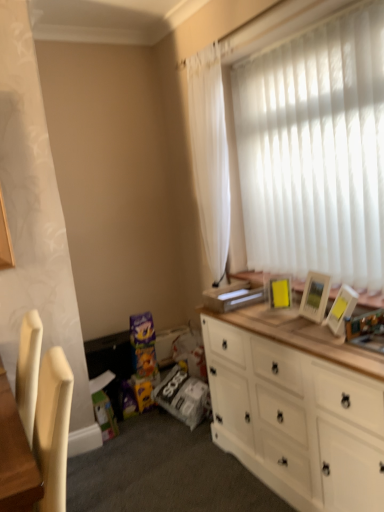
Question: Is white wood cabinet at right to the right of white glossy picture frame at upper right, acting as the second picture frame starting from the left, from the viewer's perspective?

Choices:
 (A) no
 (B) yes

Answer: (A)

Question: Considering the relative sizes of white wood cabinet at right and white glossy picture frame at upper right, which is the second picture frame in back-to-front order, in the image provided, is white wood cabinet at right shorter than white glossy picture frame at upper right, which is the second picture frame in back-to-front order,?

Choices:
 (A) yes
 (B) no

Answer: (B)

Question: From the image's perspective, is white wood cabinet at right below white glossy picture frame at upper right, the first picture frame in the right-to-left sequence?

Choices:
 (A) yes
 (B) no

Answer: (A)

Question: Is the depth of white wood cabinet at right less than that of white glossy picture frame at upper right, acting as the second picture frame starting from the left?

Choices:
 (A) no
 (B) yes

Answer: (B)

Question: Would you say white wood cabinet at right is outside white glossy picture frame at upper right, which is counted as the 1th picture frame, starting from the front?

Choices:
 (A) yes
 (B) no

Answer: (A)

Question: Is white wood cabinet at right thinner than white glossy picture frame at upper right, which is counted as the 1th picture frame, starting from the front?

Choices:
 (A) yes
 (B) no

Answer: (B)

Question: Does white sheer curtain at upper right appear on the left side of yellow matte picture frame at upper right, which appears as the 1th picture frame when viewed from the back?

Choices:
 (A) no
 (B) yes

Answer: (B)

Question: Does white sheer curtain at upper right have a larger size compared to yellow matte picture frame at upper right, the second picture frame in the right-to-left sequence?

Choices:
 (A) no
 (B) yes

Answer: (B)

Question: Is white sheer curtain at upper right beside yellow matte picture frame at upper right, the second picture frame in the right-to-left sequence?

Choices:
 (A) yes
 (B) no

Answer: (B)

Question: Is white sheer curtain at upper right at the right side of yellow matte picture frame at upper right, the first picture frame from the left?

Choices:
 (A) no
 (B) yes

Answer: (A)

Question: Would you consider white sheer curtain at upper right to be distant from yellow matte picture frame at upper right, which appears as the 1th picture frame when viewed from the back?

Choices:
 (A) no
 (B) yes

Answer: (A)

Question: From a real-world perspective, is white sheer curtain at upper right on yellow matte picture frame at upper right, the second picture frame in the right-to-left sequence?

Choices:
 (A) no
 (B) yes

Answer: (B)

Question: From the image's perspective, would you say white sheer curtain at upper right is shown under white glossy picture frame at upper right, the first picture frame in the right-to-left sequence?

Choices:
 (A) no
 (B) yes

Answer: (A)